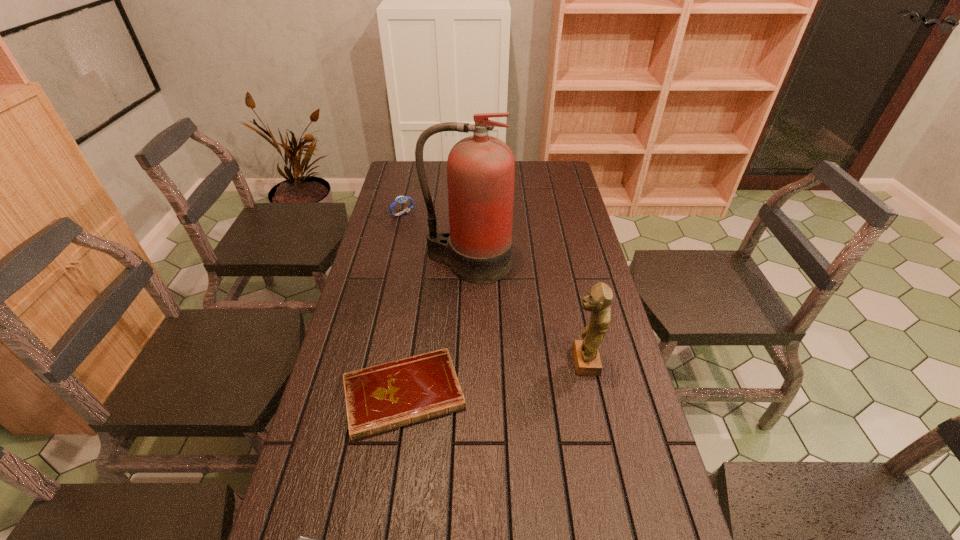
Find the location of a particular element. the tallest object is located at coordinates (480, 169).

Identify the location of the fourth nearest object. This screenshot has width=960, height=540. (480, 169).

Where is `the second tallest object`? The width and height of the screenshot is (960, 540). the second tallest object is located at coordinates (587, 361).

This screenshot has height=540, width=960. I want to click on figurine, so click(587, 361).

You are a GUI agent. You are given a task and a screenshot of the screen. Output one action in this format:
    pyautogui.click(x=<x>, y=<y>)
    Task: Click on the farthest object
    Image resolution: width=960 pixels, height=540 pixels.
    Given the screenshot: What is the action you would take?
    pyautogui.click(x=400, y=199)

The width and height of the screenshot is (960, 540). Identify the location of watch. (400, 199).

Image resolution: width=960 pixels, height=540 pixels. What are the coordinates of `the second shortest object` in the screenshot? It's located at (380, 398).

Where is `vacant space located 0.190m at the nozzle of the fourth nearest object`? The image size is (960, 540). vacant space located 0.190m at the nozzle of the fourth nearest object is located at coordinates (466, 329).

Locate an element on the screen. This screenshot has height=540, width=960. vacant space located on the front-facing side of the fourth shortest object is located at coordinates (434, 361).

This screenshot has height=540, width=960. In order to click on vacant space located on the front-facing side of the fourth shortest object in this screenshot , I will do `click(494, 361)`.